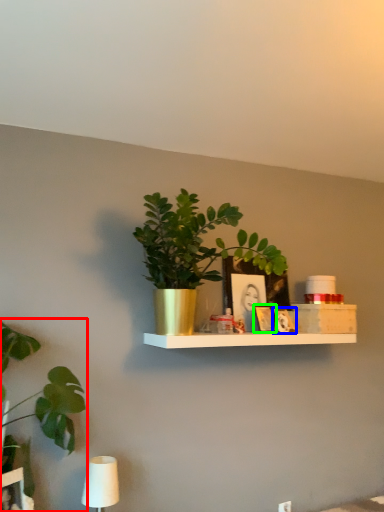
Question: Which object is the closest to the houseplant (highlighted by a red box)? Choose among these: picture frame (highlighted by a blue box) or picture frame (highlighted by a green box).

Choices:
 (A) picture frame
 (B) picture frame

Answer: (B)